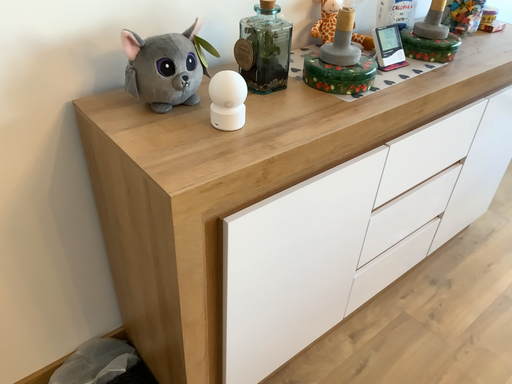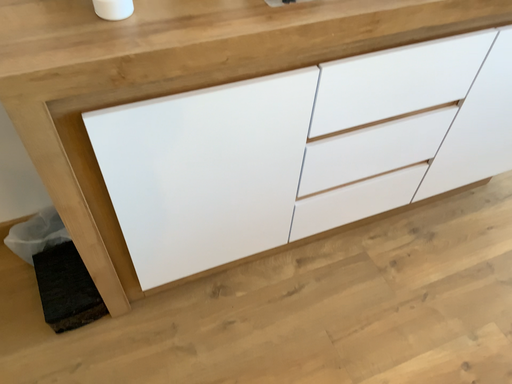
Question: Which way did the camera rotate in the video?

Choices:
 (A) rotated right
 (B) rotated left

Answer: (B)